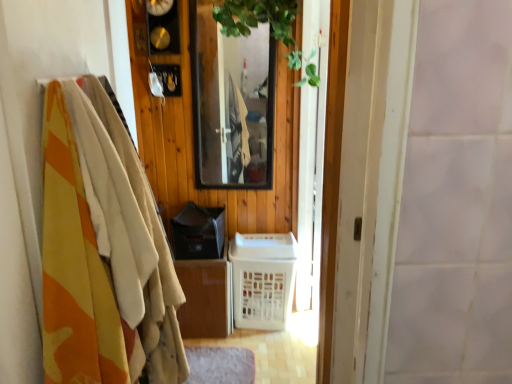
In order to click on free space behind gray soft mat at lower center in this screenshot , I will do `click(230, 341)`.